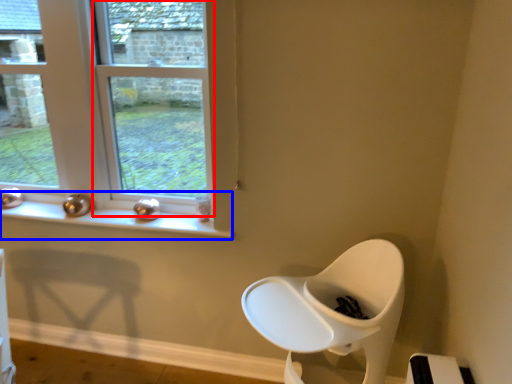
Question: Which object appears farthest to the camera in this image, window (highlighted by a red box) or window sill (highlighted by a blue box)?

Choices:
 (A) window
 (B) window sill

Answer: (B)